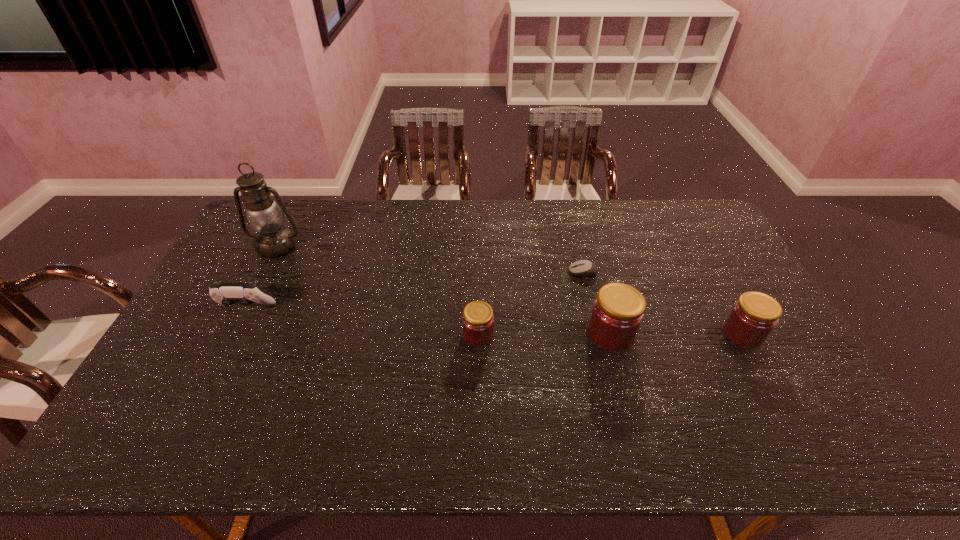
Find the location of a particular element. This screenshot has height=540, width=960. control is located at coordinates (226, 294).

You are a GUI agent. You are given a task and a screenshot of the screen. Output one action in this format:
    pyautogui.click(x=<x>, y=<y>)
    Task: Click on the free space located 0.080m on the left of the fourth object from right to left
    The width and height of the screenshot is (960, 540).
    Given the screenshot: What is the action you would take?
    tap(434, 335)

Where is `vacant space located on the left of the second jam from right to left`? vacant space located on the left of the second jam from right to left is located at coordinates (558, 334).

Image resolution: width=960 pixels, height=540 pixels. I want to click on vacant area located on the left of the rightmost object, so click(628, 334).

At what (x,y) coordinates should I click in order to perform the action: click on vacant region located 0.260m on the right of the oil lamp. Please return your answer as a coordinate pair (x, y). This screenshot has width=960, height=540. Looking at the image, I should click on click(x=378, y=246).

Image resolution: width=960 pixels, height=540 pixels. Find the location of `free space located 0.310m on the wheel side of the fifth nearest object`. free space located 0.310m on the wheel side of the fifth nearest object is located at coordinates 474,272.

Find the location of `free space located 0.210m on the wheel side of the fifth nearest object`. free space located 0.210m on the wheel side of the fifth nearest object is located at coordinates (505, 272).

Find the location of a particular element. The height and width of the screenshot is (540, 960). vacant region located on the wheel side of the fifth nearest object is located at coordinates (529, 272).

This screenshot has height=540, width=960. I want to click on vacant space located 0.170m on the front-facing side of the control, so click(x=218, y=365).

At what (x,y) coordinates should I click in order to perform the action: click on object that is at the far edge. Please return your answer as a coordinate pair (x, y). This screenshot has width=960, height=540. Looking at the image, I should click on (264, 215).